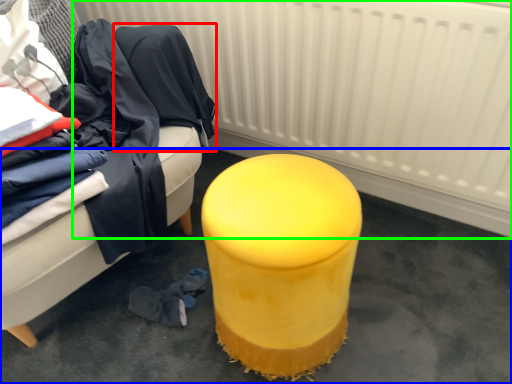
Question: Which object is the farthest from clothing (highlighted by a red box)? Choose among these: concrete (highlighted by a blue box) or radiator (highlighted by a green box).

Choices:
 (A) concrete
 (B) radiator

Answer: (A)